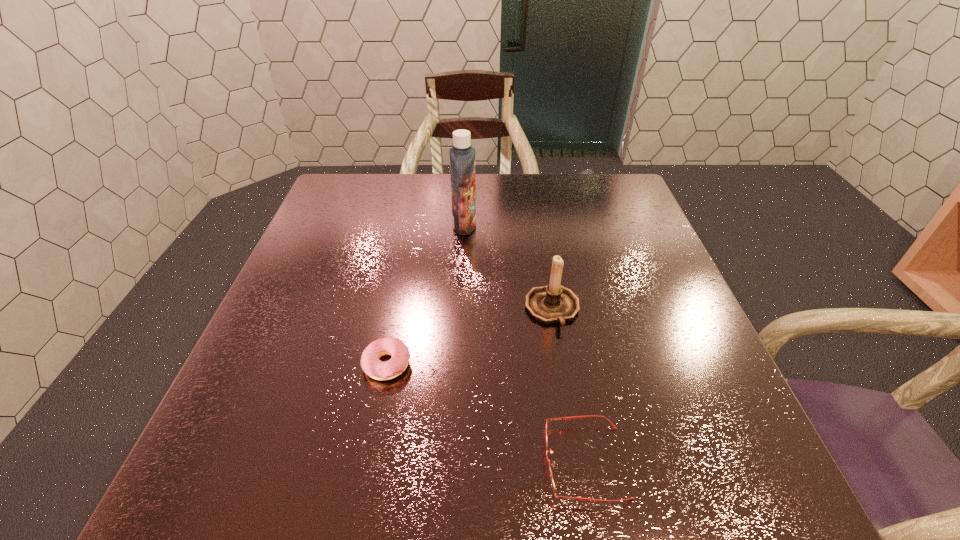
What are the coordinates of `vacant position located on the lenses of the spectacles` in the screenshot? It's located at (363, 462).

This screenshot has height=540, width=960. What are the coordinates of `vacant space positioned 0.250m on the lenses of the spectacles` in the screenshot? It's located at (389, 462).

Find the location of a particular element. The width and height of the screenshot is (960, 540). vacant space located 0.280m on the lenses of the spectacles is located at coordinates (370, 462).

Where is `object situated at the far edge`? object situated at the far edge is located at coordinates [462, 155].

Where is `object that is positioned at the near edge`? object that is positioned at the near edge is located at coordinates (572, 417).

This screenshot has height=540, width=960. Identify the location of free region at the far edge. (478, 195).

Identify the location of free region at the near edge of the desktop. The width and height of the screenshot is (960, 540). (593, 507).

Identify the location of free region at the left edge of the desktop. The height and width of the screenshot is (540, 960). (350, 260).

Locate an element on the screen. This screenshot has width=960, height=540. free space at the right edge of the desktop is located at coordinates (604, 275).

Where is `vacant space at the far left corner of the desktop`? vacant space at the far left corner of the desktop is located at coordinates (360, 176).